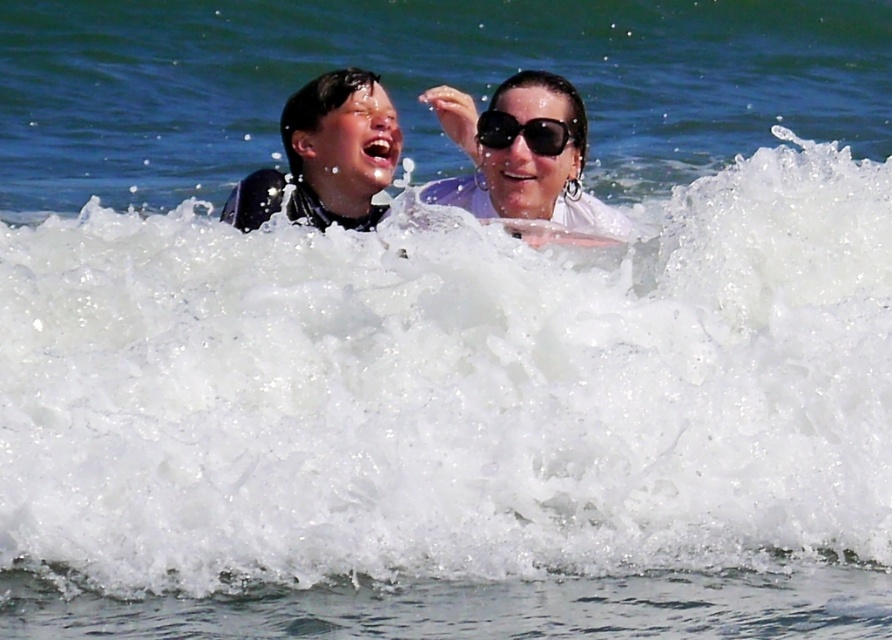
Does white matte sunglasses at upper center appear on the left side of black matte wetsuit at left?

In fact, white matte sunglasses at upper center is to the right of black matte wetsuit at left.

Is white matte sunglasses at upper center smaller than black matte wetsuit at left?

Incorrect, white matte sunglasses at upper center is not smaller in size than black matte wetsuit at left.

Is point (447, 104) positioned behind point (366, 227)?

Yes, point (447, 104) is behind point (366, 227).

Where is `white matte sunglasses at upper center`? This screenshot has width=892, height=640. white matte sunglasses at upper center is located at coordinates (522, 154).

Can you confirm if black matte wetsuit at left is positioned above black plastic sunglasses at upper center?

Incorrect, black matte wetsuit at left is not positioned above black plastic sunglasses at upper center.

Which is above, black matte wetsuit at left or black plastic sunglasses at upper center?

Positioned higher is black plastic sunglasses at upper center.

Is point (281, 189) farther from camera compared to point (546, 116)?

Yes, point (281, 189) is farther from viewer.

I want to click on black matte wetsuit at left, so click(x=286, y=204).

Does white matte sunglasses at upper center appear under black plastic sunglasses at upper center?

Actually, white matte sunglasses at upper center is above black plastic sunglasses at upper center.

Does white matte sunglasses at upper center lie behind black plastic sunglasses at upper center?

No.

Which is behind, point (494, 102) or point (574, 131)?

The point (574, 131) is more distant.

I want to click on white matte sunglasses at upper center, so click(x=522, y=154).